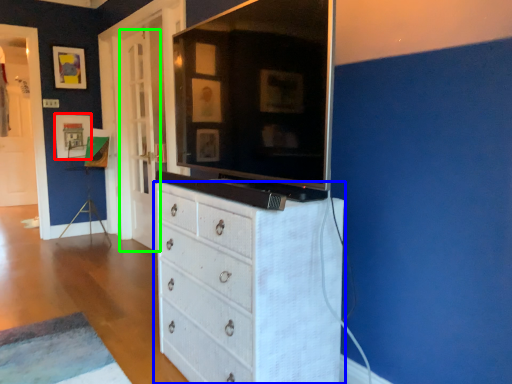
Question: Which is nearer to the picture frame (highlighted by a red box)? chest of drawers (highlighted by a blue box) or door (highlighted by a green box).

Choices:
 (A) chest of drawers
 (B) door

Answer: (B)